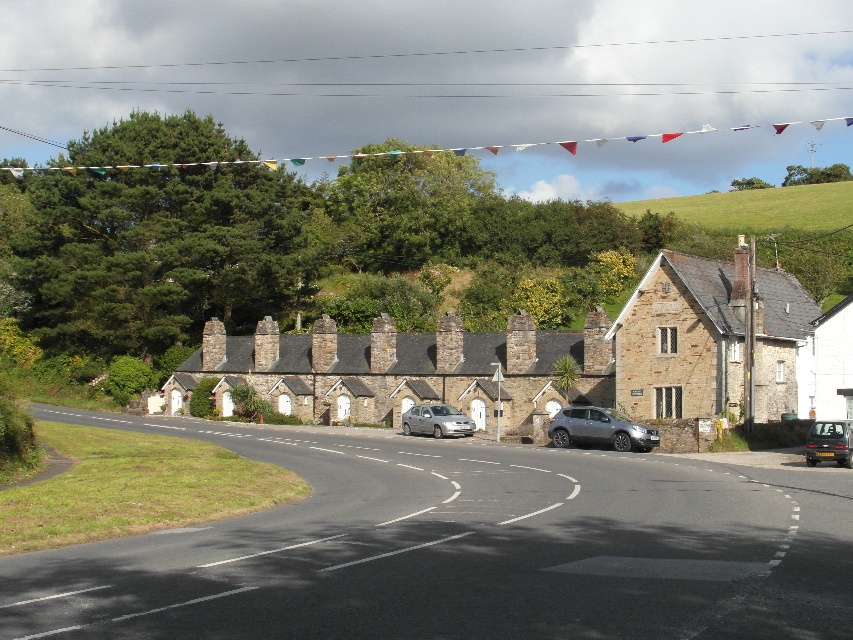
You are a delivery driver who needs to park your vehicle on the road near the cottages. You see the green grassy hillside at upper right and the silver metallic van at center. Which object is higher in elevation compared to the other?

The green grassy hillside at upper right is located above the silver metallic van at center, so it has a higher elevation than the van.

You are standing at the point with coordinates point (848, 456) and want to walk towards the point with coordinates point (456, 360). According to the scene, will you pass by any of the parked cars along the way?

Point (456, 360) is behind point (848, 456), so you are already facing away from the direction you want to walk. Therefore, you would not pass by any parked cars along the way.